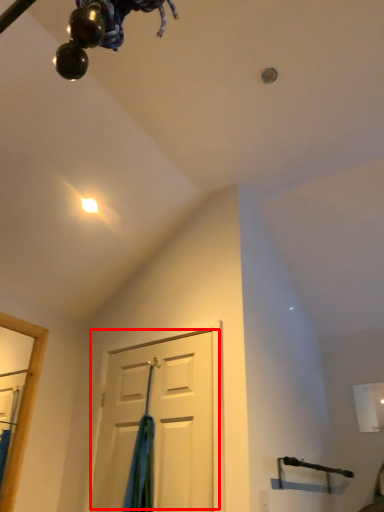
Question: From the image's perspective, what is the correct spatial relationship of door (annotated by the red box) in relation to curtain?

Choices:
 (A) below
 (B) above

Answer: (B)